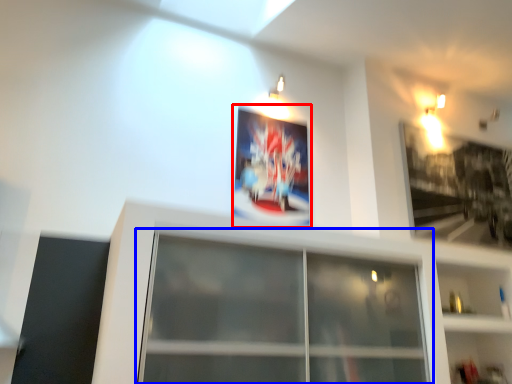
Question: Which of the following is the farthest to the observer, picture frame (highlighted by a red box) or window (highlighted by a blue box)?

Choices:
 (A) picture frame
 (B) window

Answer: (A)